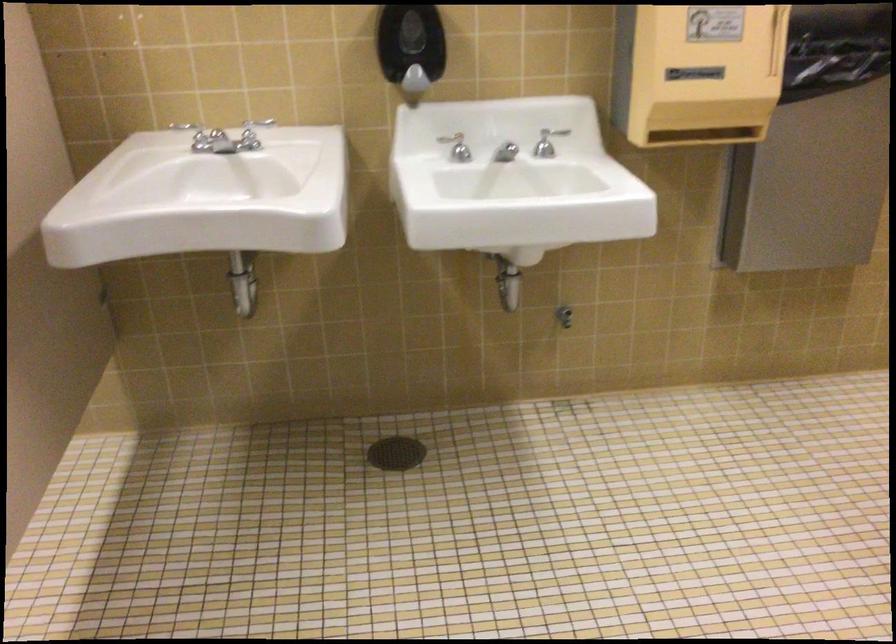
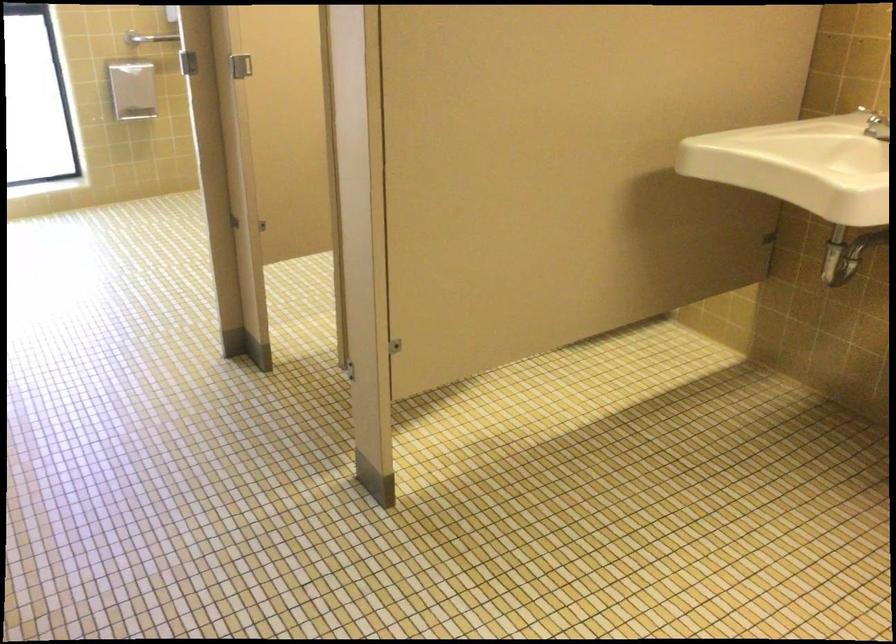
Question: The first image is from the beginning of the video and the second image is from the end. How did the camera likely rotate when shooting the video?

Choices:
 (A) Left
 (B) Right
 (C) Up
 (D) Down

Answer: (A)